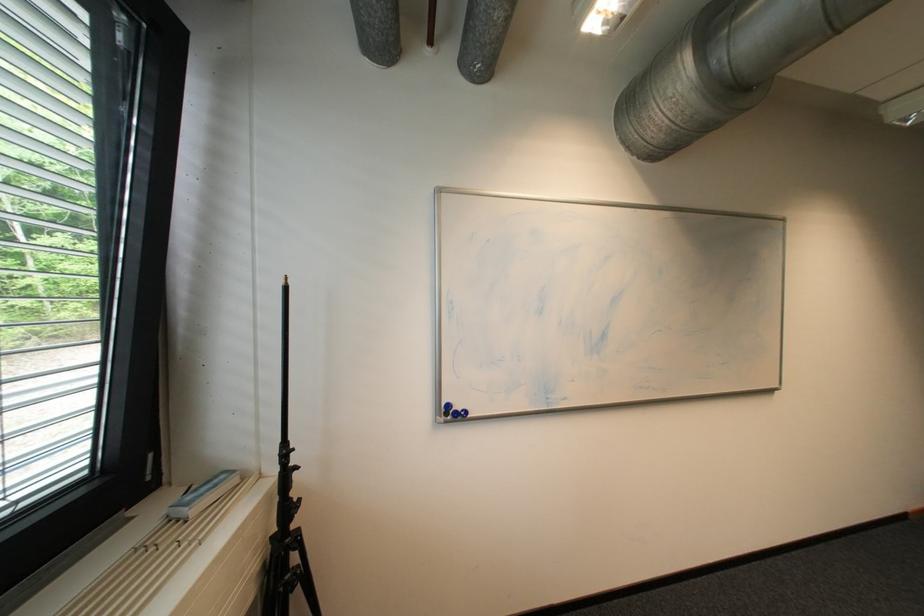
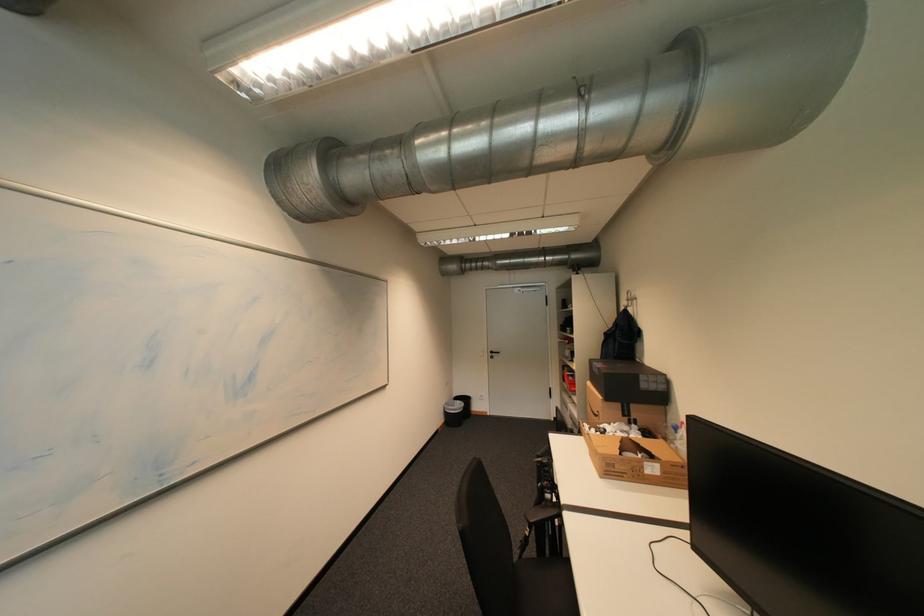
Question: The images are taken continuously from a first-person perspective. In which direction is your viewpoint rotating?

Choices:
 (A) Left
 (B) Right
 (C) Up
 (D) Down

Answer: (B)